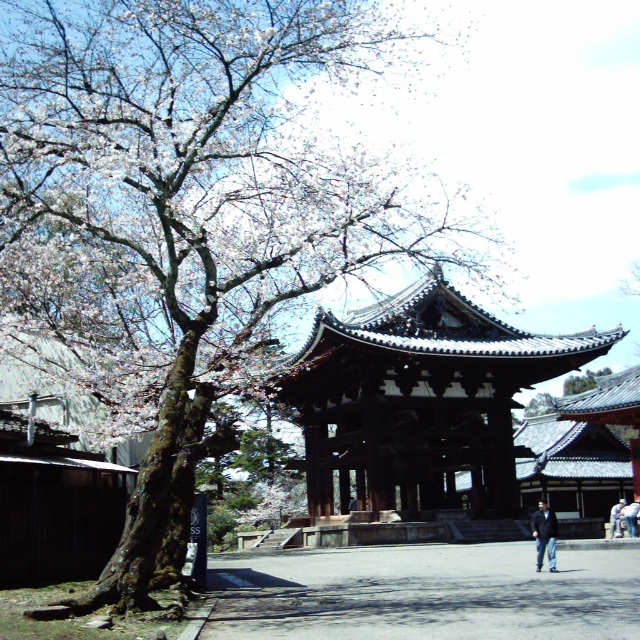
Does dark brown wooden gate at center have a lesser width compared to light blue denim jeans at lower right?

In fact, dark brown wooden gate at center might be wider than light blue denim jeans at lower right.

Is point (385, 348) positioned after point (612, 532)?

No, it is not.

This screenshot has height=640, width=640. I want to click on dark brown wooden gate at center, so click(x=419, y=401).

Can you confirm if dark blue jeans at lower right is wider than denim pants at lower right?

Correct, the width of dark blue jeans at lower right exceeds that of denim pants at lower right.

Who is shorter, dark blue jeans at lower right or denim pants at lower right?

With less height is denim pants at lower right.

The image size is (640, 640). In order to click on dark blue jeans at lower right in this screenshot , I will do (545, 534).

At what (x,y) coordinates should I click in order to perform the action: click on dark blue jeans at lower right. Please return your answer as a coordinate pair (x, y). The height and width of the screenshot is (640, 640). Looking at the image, I should click on (545, 534).

Identify the location of dark brown wooden gate at center. (419, 401).

Describe the element at coordinates (419, 401) in the screenshot. I see `dark brown wooden gate at center` at that location.

Where is `dark brown wooden gate at center`? The width and height of the screenshot is (640, 640). dark brown wooden gate at center is located at coordinates (419, 401).